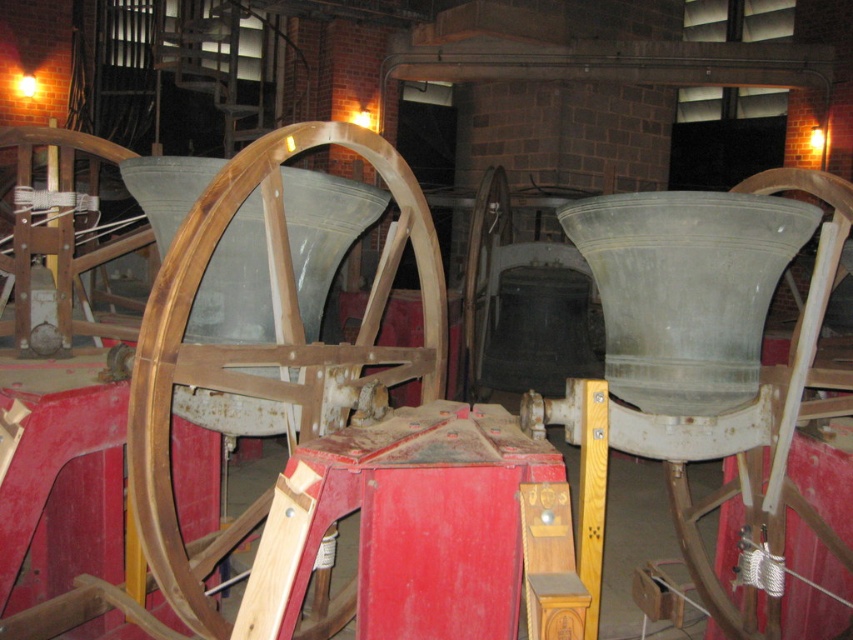
Based on the photo, you are a maintenance worker needing to inspect the wooden wheel at center. The safety protocol states that you must stay at least 2 meters away from any moving parts. Are you within a safe distance if you stand where the camera is positioned?

The wooden wheel at center is 1.82 meters from camera, which is less than the required 2 meters safety distance. Therefore, standing at the camera position would not be safe.

You are standing in the bell tower and want to adjust the mechanism connected to the metallic gray bell at center and the wooden at center. Which bell is positioned to the right of the other?

The metallic gray bell at center is to the right of wooden at center.

You are a maintenance worker in the bell tower. You need to determine which object, the metallic gray bell at center or the wooden at center, has a larger width to decide which tool to use. Based on the scene, which one is wider?

The metallic gray bell at center is wider than the wooden at center, so you should use the tool appropriate for the metallic gray bell at center.